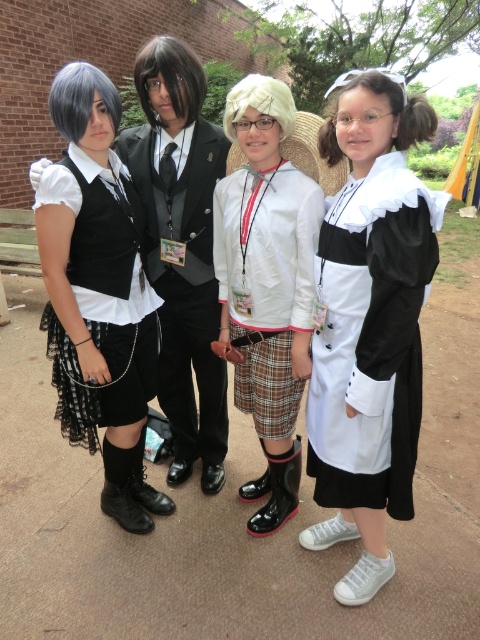
Who is taller, white matte dress at center or blonde synthetic wig at upper right?

With more height is white matte dress at center.

Measure the distance from white matte dress at center to blonde synthetic wig at upper right.

The distance of white matte dress at center from blonde synthetic wig at upper right is 26.97 inches.

Locate an element on the screen. This screenshot has height=640, width=480. white matte dress at center is located at coordinates (372, 339).

You are a GUI agent. You are given a task and a screenshot of the screen. Output one action in this format:
    pyautogui.click(x=<x>, y=<y>)
    Task: Click on the white matte dress at center
    The image size is (480, 640).
    Given the screenshot: What is the action you would take?
    pyautogui.click(x=372, y=339)

Which is above, white matte dress at center or white matte jacket at center?

Positioned higher is white matte jacket at center.

Who is lower down, white matte dress at center or white matte jacket at center?

white matte dress at center is lower down.

Who is more distant from viewer, (333, 209) or (264, 381)?

The point (264, 381) is more distant.

Find the location of `white matte dress at center`. white matte dress at center is located at coordinates (372, 339).

What do you see at coordinates (389, 109) in the screenshot?
I see `blonde synthetic wig at upper right` at bounding box center [389, 109].

Is point (400, 144) positioned in front of point (172, 104)?

Yes, it is.

Is point (348, 88) farther from camera compared to point (184, 102)?

No, it is in front of (184, 102).

You are a GUI agent. You are given a task and a screenshot of the screen. Output one action in this format:
    pyautogui.click(x=<x>, y=<y>)
    Task: Click on the blonde synthetic wig at upper right
    
    Given the screenshot: What is the action you would take?
    click(389, 109)